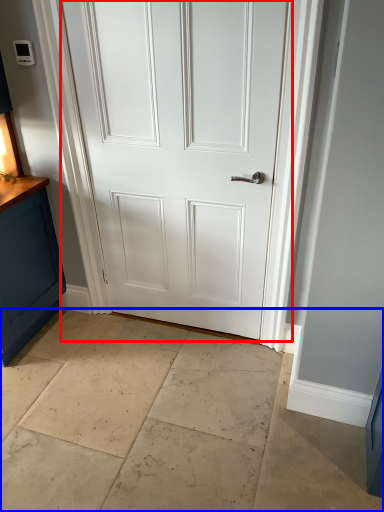
Question: Which object is closer to the camera taking this photo, door (highlighted by a red box) or concrete (highlighted by a blue box)?

Choices:
 (A) door
 (B) concrete

Answer: (B)